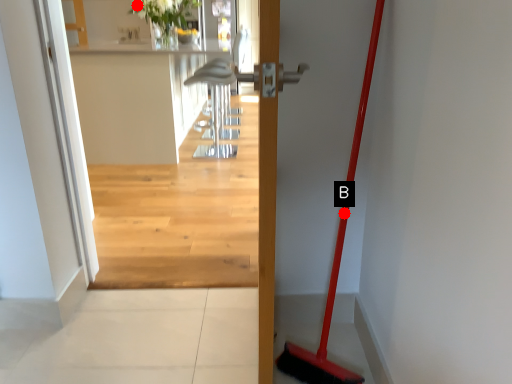
Question: Two points are circled on the image, labeled by A and B beside each circle. Which point appears farthest from the camera in this image?

Choices:
 (A) A is further
 (B) B is further

Answer: (A)